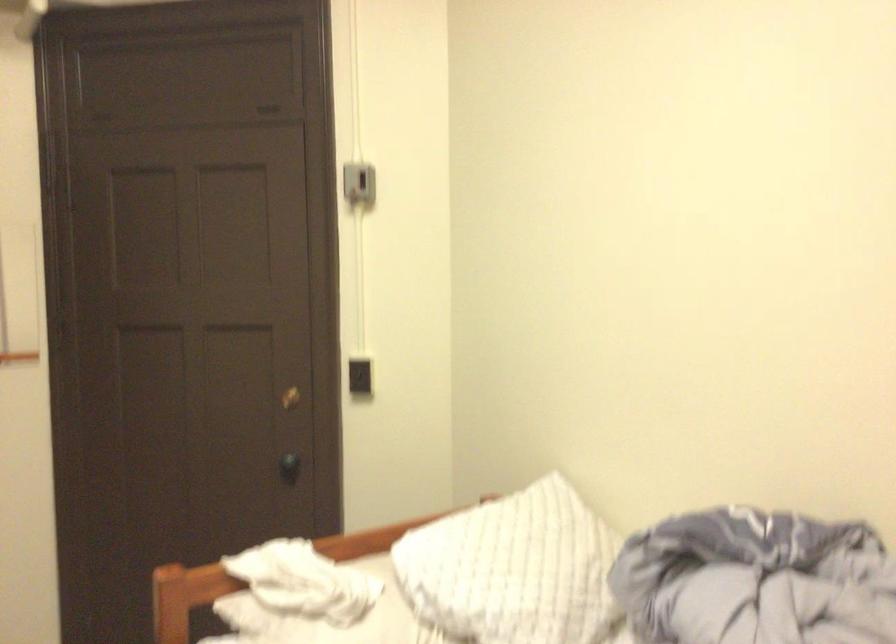
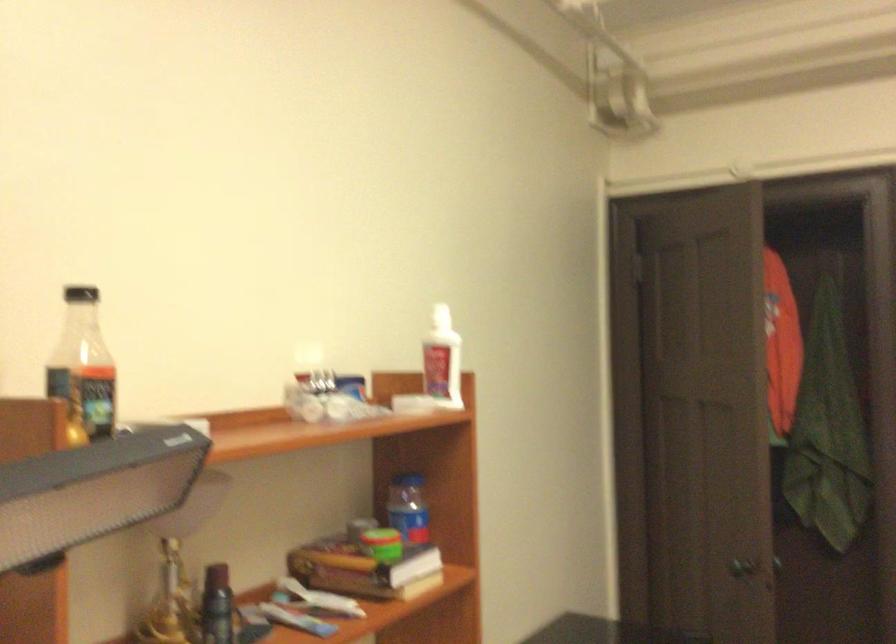
Question: The images are taken continuously from a first-person perspective. In which direction is your viewpoint rotating?

Choices:
 (A) Left
 (B) Right
 (C) Up
 (D) Down

Answer: (A)